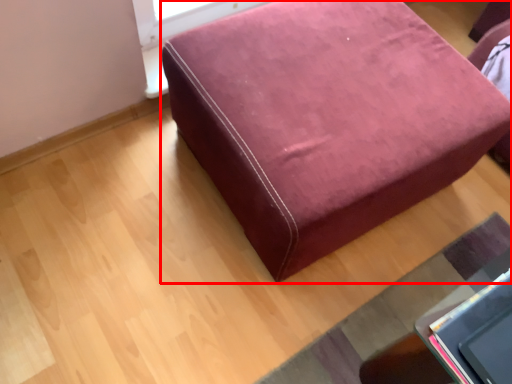
Question: From the image's perspective, what is the correct spatial relationship of furniture (annotated by the red box) in relation to mat?

Choices:
 (A) below
 (B) above

Answer: (B)